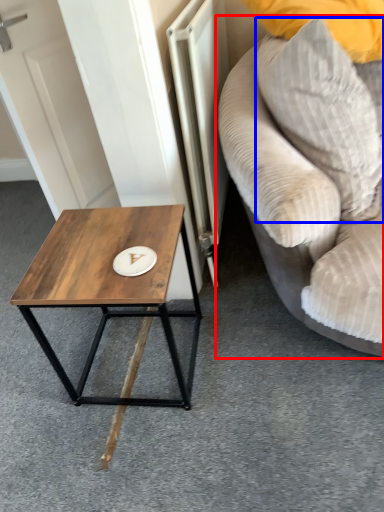
Question: Which object appears closest to the camera in this image, studio couch (highlighted by a red box) or pillow (highlighted by a blue box)?

Choices:
 (A) studio couch
 (B) pillow

Answer: (A)